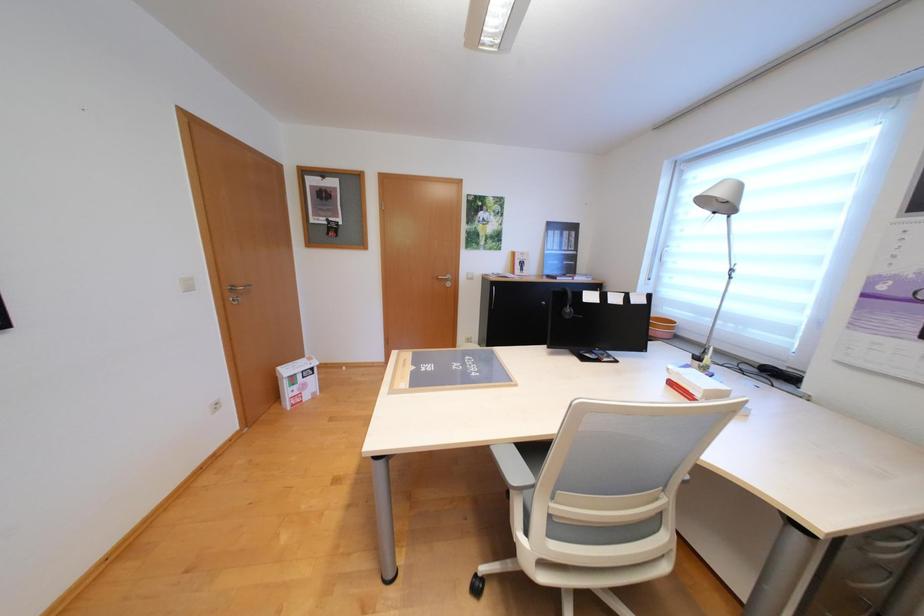
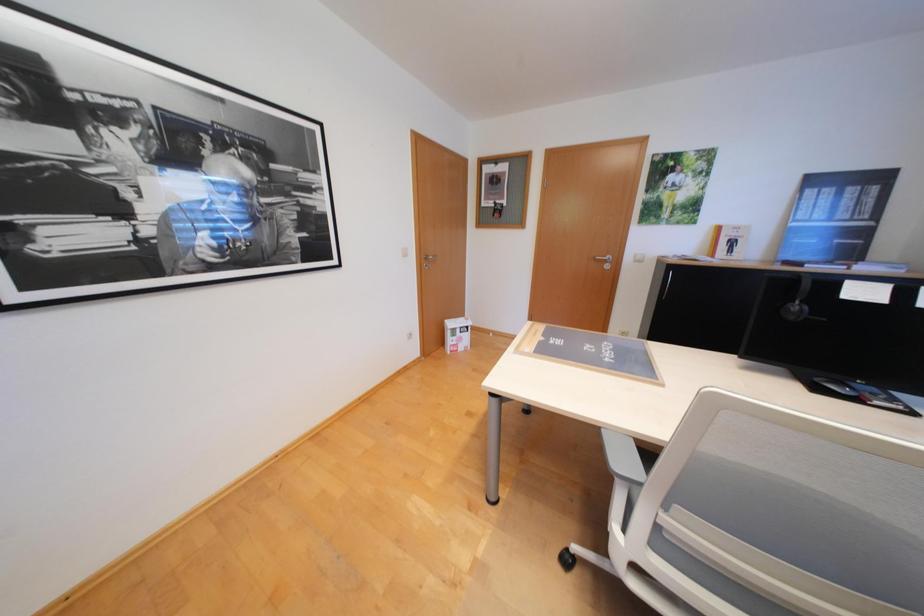
Question: Based on the continuous images, in which direction is the camera rotating? Reply with the corresponding letter.

Choices:
 (A) Left
 (B) Right
 (C) Up
 (D) Down

Answer: (A)